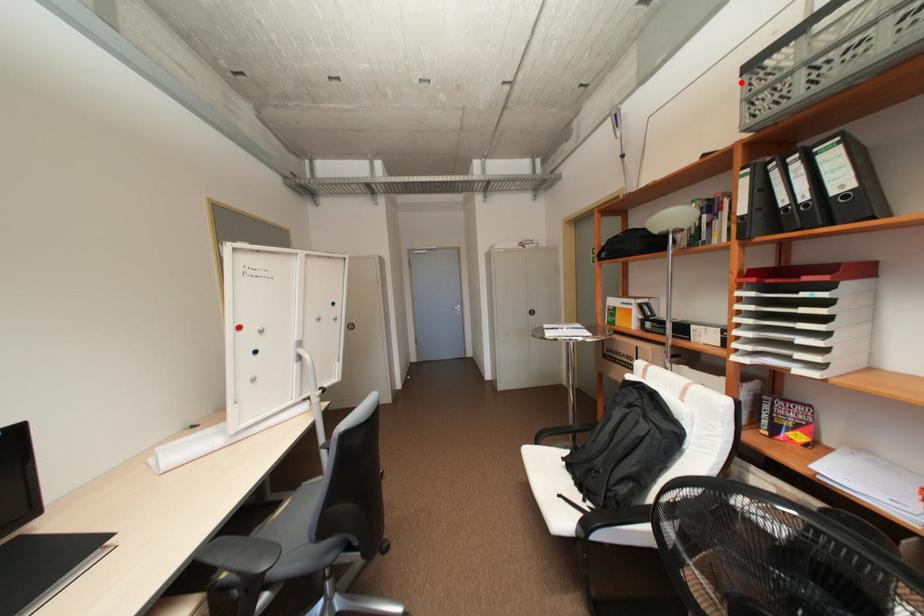
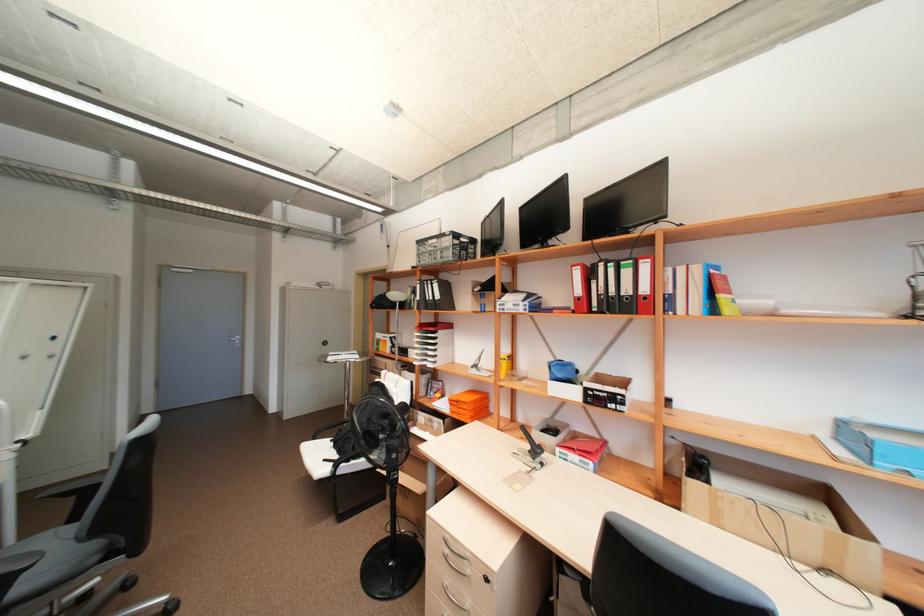
The point at the highlighted location is marked in the first image. Where is the corresponding point in the second image?

(420, 246)